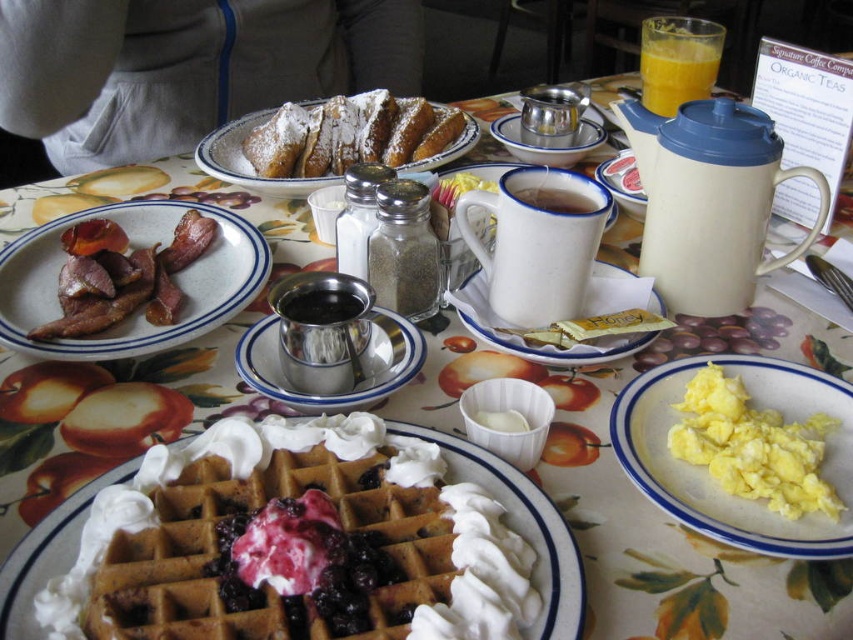
You are a guest at this breakfast table and want to reach for the syrup. There are two desserts in front of you, the golden brown waffle with whipped cream and berries at center and the powdered sugar pastry at center. Which dessert is closer to your left hand?

The powdered sugar pastry at center is closer to your left hand because the golden brown waffle with whipped cream and berries at center is positioned on the right side of it.

You are setting up a breakfast table and need to pour syrup from the silver metallic syrup container at center into the white matte mug at center. Which object will you pick up first to start this task?

You should pick up the silver metallic syrup container at center first because it is larger in size than the white matte mug at center, making it easier to handle for pouring.

What is located at the point with coordinates (x=705, y=468) in the image?

The point with coordinates (x=705, y=468) marks the location of the yellow scrambled eggs at lower right.